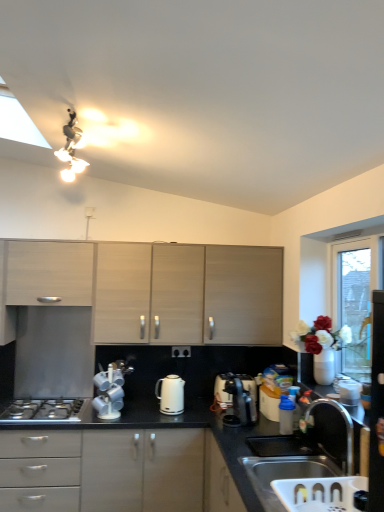
Question: Is matte wood cabinet at left, which appears as the 2th cabinetry when viewed from the right, facing away from white glossy electric kettle at center?

Choices:
 (A) yes
 (B) no

Answer: (B)

Question: Is the depth of matte wood cabinet at left, which appears as the 2th cabinetry when viewed from the right, less than that of white glossy electric kettle at center?

Choices:
 (A) yes
 (B) no

Answer: (B)

Question: Does matte wood cabinet at left, placed as the 1th cabinetry when sorted from left to right, appear on the right side of white glossy electric kettle at center?

Choices:
 (A) no
 (B) yes

Answer: (A)

Question: Considering the relative sizes of matte wood cabinet at left, which appears as the 2th cabinetry when viewed from the right, and white glossy electric kettle at center in the image provided, is matte wood cabinet at left, which appears as the 2th cabinetry when viewed from the right, thinner than white glossy electric kettle at center?

Choices:
 (A) yes
 (B) no

Answer: (B)

Question: Considering the relative sizes of matte wood cabinet at left, which appears as the 2th cabinetry when viewed from the right, and white glossy electric kettle at center in the image provided, is matte wood cabinet at left, which appears as the 2th cabinetry when viewed from the right, smaller than white glossy electric kettle at center?

Choices:
 (A) no
 (B) yes

Answer: (A)

Question: From a real-world perspective, is matte wood cabinet at left, which appears as the 2th cabinetry when viewed from the right, physically above white glossy electric kettle at center?

Choices:
 (A) yes
 (B) no

Answer: (A)

Question: From the image's perspective, does silver metallic gas stove at lower left appear lower than matte wood cabinet at left, placed as the 1th cabinetry when sorted from left to right?

Choices:
 (A) no
 (B) yes

Answer: (B)

Question: Does silver metallic gas stove at lower left lie behind matte wood cabinet at left, which appears as the 2th cabinetry when viewed from the right?

Choices:
 (A) no
 (B) yes

Answer: (A)

Question: Does silver metallic gas stove at lower left have a lesser width compared to matte wood cabinet at left, placed as the 1th cabinetry when sorted from left to right?

Choices:
 (A) yes
 (B) no

Answer: (B)

Question: Can you confirm if silver metallic gas stove at lower left is wider than matte wood cabinet at left, placed as the 1th cabinetry when sorted from left to right?

Choices:
 (A) no
 (B) yes

Answer: (B)

Question: Is the depth of silver metallic gas stove at lower left less than that of matte wood cabinet at left, which appears as the 2th cabinetry when viewed from the right?

Choices:
 (A) yes
 (B) no

Answer: (A)

Question: Is silver metallic gas stove at lower left next to matte wood cabinet at left, which appears as the 2th cabinetry when viewed from the right, and touching it?

Choices:
 (A) yes
 (B) no

Answer: (B)

Question: From the image's perspective, is blue plastic container at lower right, which ranks as the 2th appliance in front-to-back order, located beneath matte wood cabinets at center, which ranks as the 1th cabinetry in right-to-left order?

Choices:
 (A) no
 (B) yes

Answer: (B)